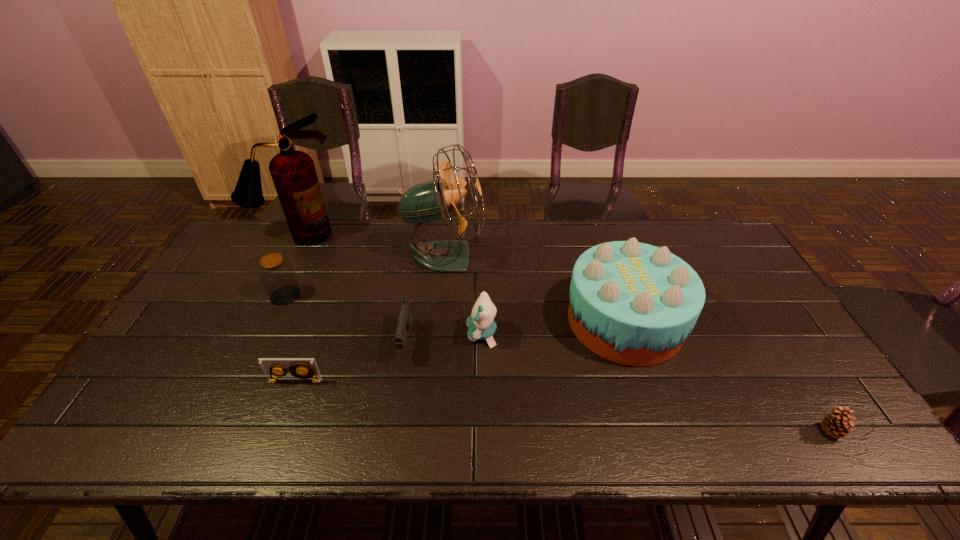
I want to click on free space located 0.210m at the nozzle of the fire extinguisher, so click(x=272, y=288).

Where is `blank space located 0.170m on the front-facing side of the fan for air flow`? Image resolution: width=960 pixels, height=540 pixels. blank space located 0.170m on the front-facing side of the fan for air flow is located at coordinates (537, 256).

You are a GUI agent. You are given a task and a screenshot of the screen. Output one action in this format:
    pyautogui.click(x=<x>, y=<y>)
    Task: Click on the vacant space located on the back of the seventh object from left to right
    The height and width of the screenshot is (540, 960).
    Given the screenshot: What is the action you would take?
    pyautogui.click(x=595, y=232)

The image size is (960, 540). I want to click on free space located 0.180m on the front of the jar, so click(x=257, y=355).

Where is `blank space located 0.260m on the face of the kitten`? This screenshot has width=960, height=540. blank space located 0.260m on the face of the kitten is located at coordinates (372, 334).

I want to click on vacant position located 0.240m on the face of the kitten, so click(x=379, y=334).

The height and width of the screenshot is (540, 960). Identify the location of free point located 0.060m on the face of the kitten. (444, 334).

Where is `blank space located at the barrel of the pistol`? The height and width of the screenshot is (540, 960). blank space located at the barrel of the pistol is located at coordinates (396, 409).

At what (x,y) coordinates should I click in order to perform the action: click on free space located 0.170m at the front of the videotape with visible reels. Please return your answer as a coordinate pair (x, y). This screenshot has width=960, height=540. Looking at the image, I should click on (271, 449).

At what (x,y) coordinates should I click in order to perform the action: click on vacant area situated on the left of the rightmost object. Please return your answer as a coordinate pair (x, y). The width and height of the screenshot is (960, 540). Looking at the image, I should click on (719, 431).